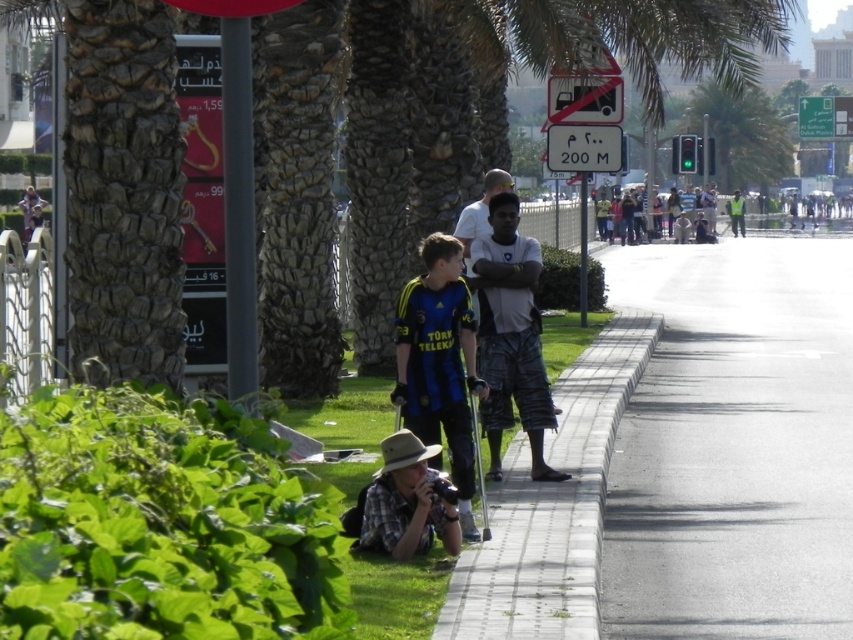
What do you see at coordinates (511, 337) in the screenshot? I see `camouflage pants at center` at bounding box center [511, 337].

Does point (518, 406) come behind point (469, 234)?

No, (518, 406) is closer to viewer.

Describe the element at coordinates (511, 337) in the screenshot. This screenshot has width=853, height=640. I see `camouflage pants at center` at that location.

The height and width of the screenshot is (640, 853). I want to click on camouflage pants at center, so click(511, 337).

Is camouflage pants at center positioned before brushed metal bus at upper center?

Yes, it is.

Which is more to the left, camouflage pants at center or brushed metal bus at upper center?

camouflage pants at center is more to the left.

This screenshot has width=853, height=640. I want to click on camouflage pants at center, so click(x=511, y=337).

Is point (686, 44) more distant than point (585, 92)?

Yes, it is.

Does point (380, 248) lie behind point (579, 118)?

No.

You are a GUI agent. You are given a task and a screenshot of the screen. Output one action in this format:
    pyautogui.click(x=<x>, y=<y>)
    Task: Click on the brown textured palm tree at center
    Image resolution: width=853 pixels, height=640 pixels.
    Given the screenshot: What is the action you would take?
    pyautogui.click(x=115, y=179)